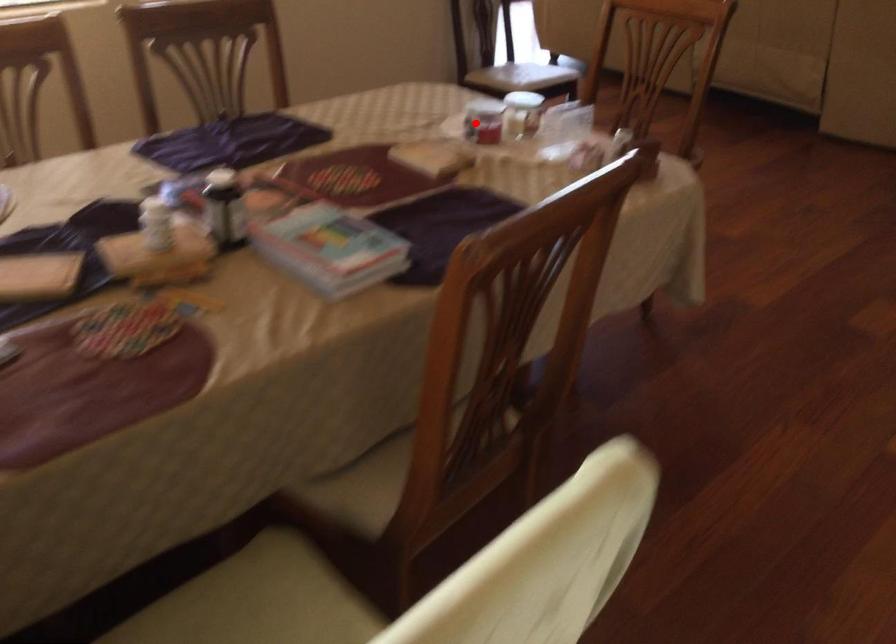
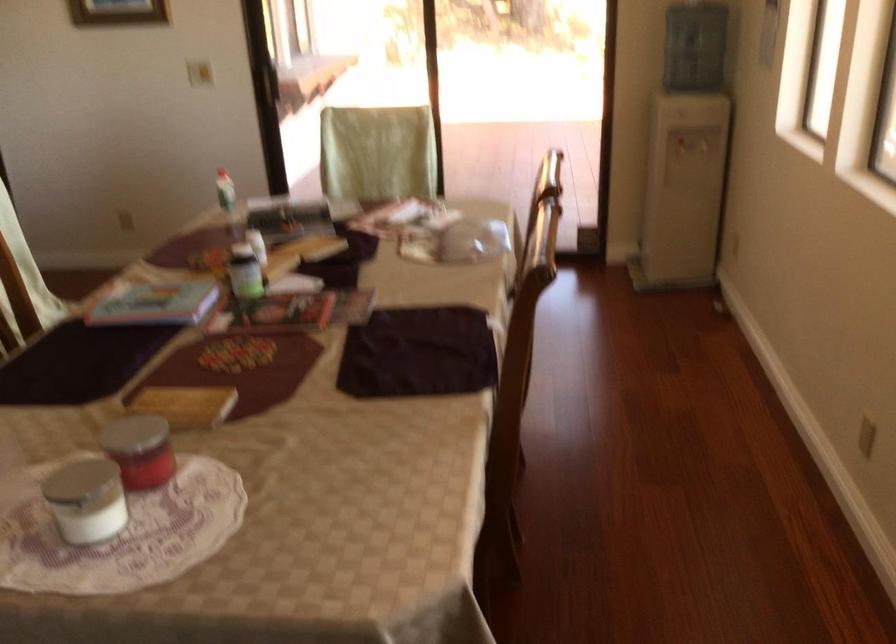
Question: I am providing you with two images of the same scene from different viewpoints. A red point is shown in image1. For the corresponding object point in image2, is it positioned nearer or farther from the camera?

Choices:
 (A) Nearer
 (B) Farther

Answer: (A)